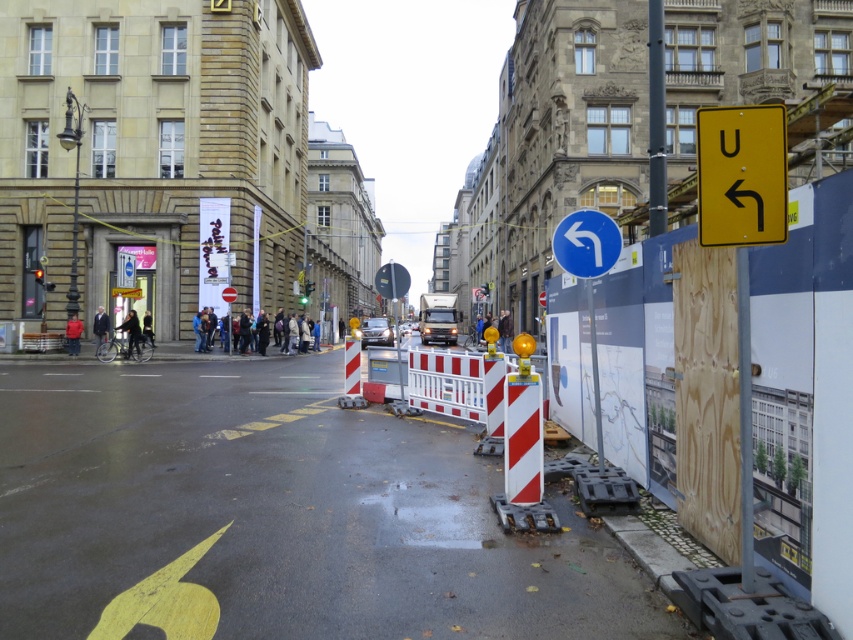
Is blue plastic traffic sign at center behind dark blue jacket at left?

No, it is not.

Who is higher up, blue plastic traffic sign at center or dark blue jacket at left?

blue plastic traffic sign at center is higher up.

Locate an element on the screen. Image resolution: width=853 pixels, height=640 pixels. blue plastic traffic sign at center is located at coordinates (585, 243).

Where is `metallic pole at upper right`? Image resolution: width=853 pixels, height=640 pixels. metallic pole at upper right is located at coordinates (656, 122).

Between point (654, 136) and point (242, 332), which one is positioned in front?

Point (654, 136)

Is point (664, 138) farther from viewer compared to point (285, 333)?

No, it is in front of (285, 333).

Where is `metallic pole at upper right`? This screenshot has height=640, width=853. metallic pole at upper right is located at coordinates (656, 122).

Is point (585, 234) more distant than point (317, 337)?

That is False.

Is point (602, 212) positioned behind point (285, 328)?

No.

Locate an element on the screen. blue plastic traffic sign at center is located at coordinates (585, 243).